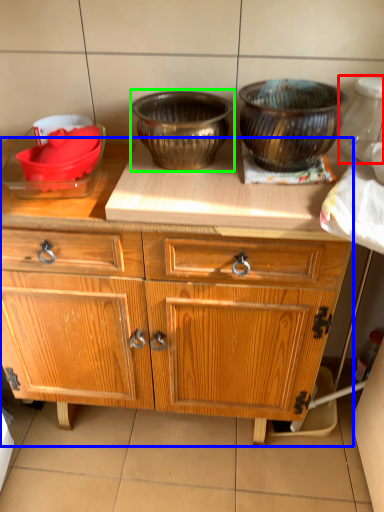
Question: Which object is the closest to the pottery (highlighted by a red box)? Choose among these: cabinetry (highlighted by a blue box) or bowl (highlighted by a green box).

Choices:
 (A) cabinetry
 (B) bowl

Answer: (B)